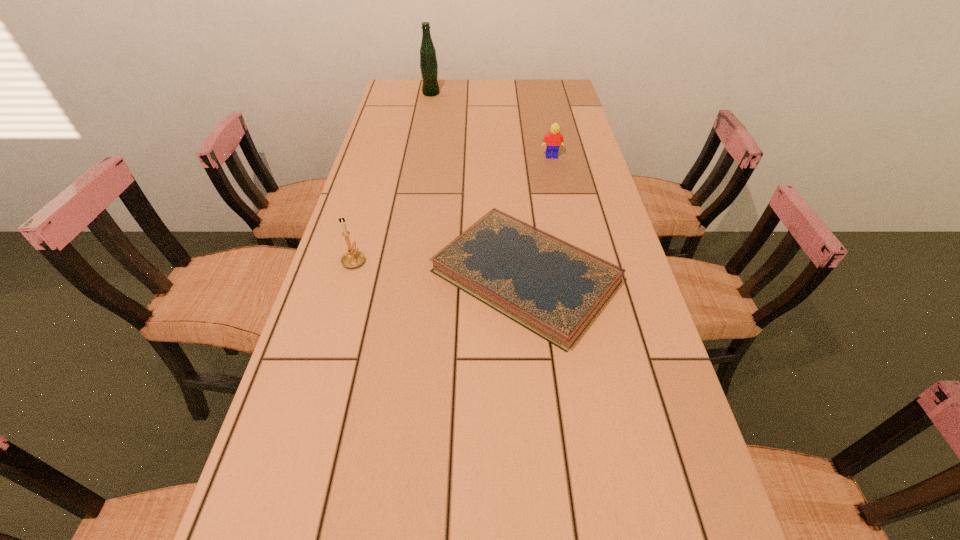
The height and width of the screenshot is (540, 960). Identify the location of the third object from right to left. (428, 60).

At what (x,y) coordinates should I click in order to perform the action: click on the farthest object. Please return your answer as a coordinate pair (x, y). Looking at the image, I should click on (428, 60).

At what (x,y) coordinates should I click in order to perform the action: click on the second tallest object. Please return your answer as a coordinate pair (x, y). Looking at the image, I should click on pos(353,258).

You are a GUI agent. You are given a task and a screenshot of the screen. Output one action in this format:
    pyautogui.click(x=<x>, y=<y>)
    Task: Click on the candle holder
    
    Given the screenshot: What is the action you would take?
    pyautogui.click(x=353, y=258)

Locate an element on the screen. The image size is (960, 540). Lego is located at coordinates (x=553, y=140).

The image size is (960, 540). In order to click on the second farthest object in this screenshot , I will do `click(553, 140)`.

Identify the location of the shortest object. Image resolution: width=960 pixels, height=540 pixels. (554, 289).

Find the location of `vacant space situated 0.090m on the back of the beer bottle`. vacant space situated 0.090m on the back of the beer bottle is located at coordinates (433, 80).

The width and height of the screenshot is (960, 540). Identify the location of vacant space located on the handle side of the third shortest object. pyautogui.click(x=374, y=188).

This screenshot has width=960, height=540. I want to click on vacant space located 0.050m on the handle side of the third shortest object, so click(361, 237).